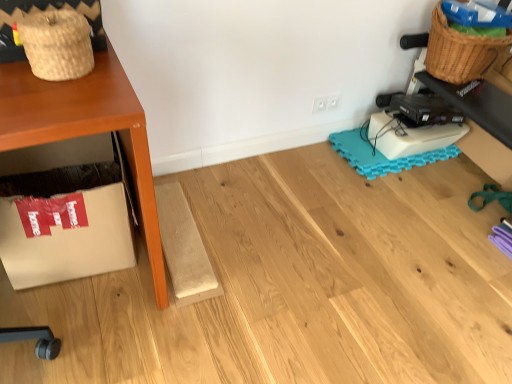
Where is `unoccupied area in front of white cardboard box at lower left`? The image size is (512, 384). unoccupied area in front of white cardboard box at lower left is located at coordinates (70, 324).